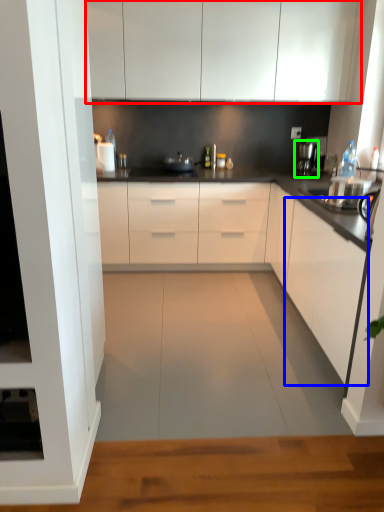
Question: Estimate the real-world distances between objects in this image. Which object is farther from cabinetry (highlighted by a red box), cabinetry (highlighted by a blue box) or coffee machine (highlighted by a green box)?

Choices:
 (A) cabinetry
 (B) coffee machine

Answer: (A)